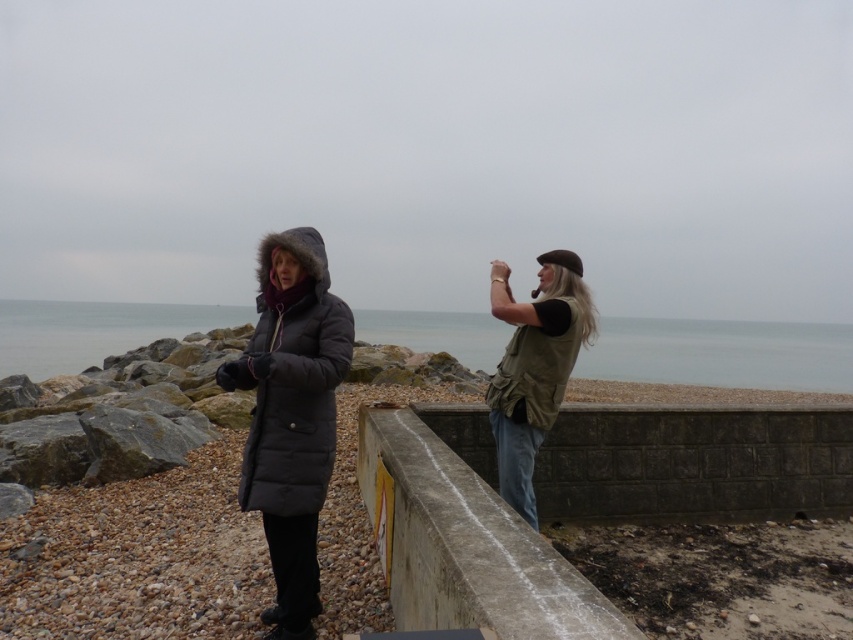
Question: Which object is positioned closest to the gray water at center?

Choices:
 (A) khaki fabric vest at center
 (B) concrete ledge at center

Answer: (B)

Question: Considering the relative positions of concrete ledge at center and khaki fabric vest at center in the image provided, where is concrete ledge at center located with respect to khaki fabric vest at center?

Choices:
 (A) below
 (B) above

Answer: (A)

Question: Can you confirm if gray water at center is positioned to the left of matte black coat at center?

Choices:
 (A) yes
 (B) no

Answer: (B)

Question: Is concrete ledge at center further to the viewer compared to khaki fabric vest at center?

Choices:
 (A) yes
 (B) no

Answer: (B)

Question: Which point is closer to the camera taking this photo?

Choices:
 (A) (503, 630)
 (B) (770, 346)
 (C) (525, 380)
 (D) (279, 298)

Answer: (A)

Question: Which of these objects is positioned closest to the gray water at center?

Choices:
 (A) concrete ledge at center
 (B) matte black coat at center

Answer: (B)